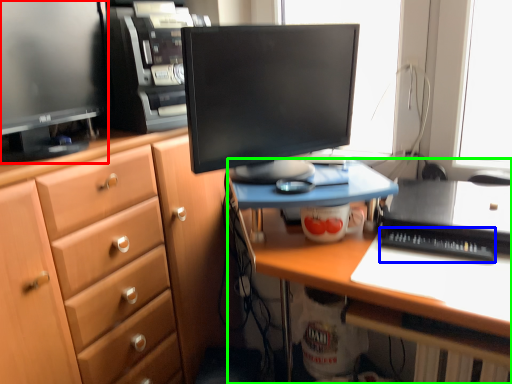
Question: Which object is the farthest from computer monitor (highlighted by a red box)? Choose among these: laptop keyboard (highlighted by a blue box) or desk (highlighted by a green box).

Choices:
 (A) laptop keyboard
 (B) desk

Answer: (A)